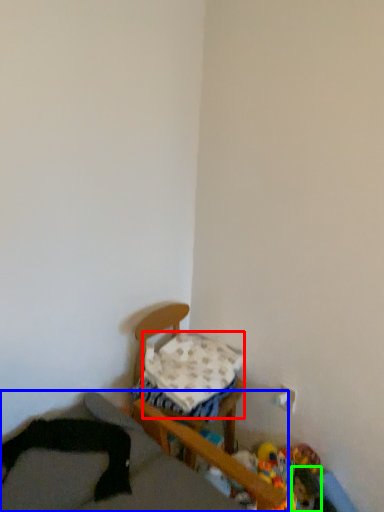
Question: Which is farther away from pillow (highlighted by a red box)? furniture (highlighted by a blue box) or toy (highlighted by a green box)?

Choices:
 (A) furniture
 (B) toy

Answer: (B)